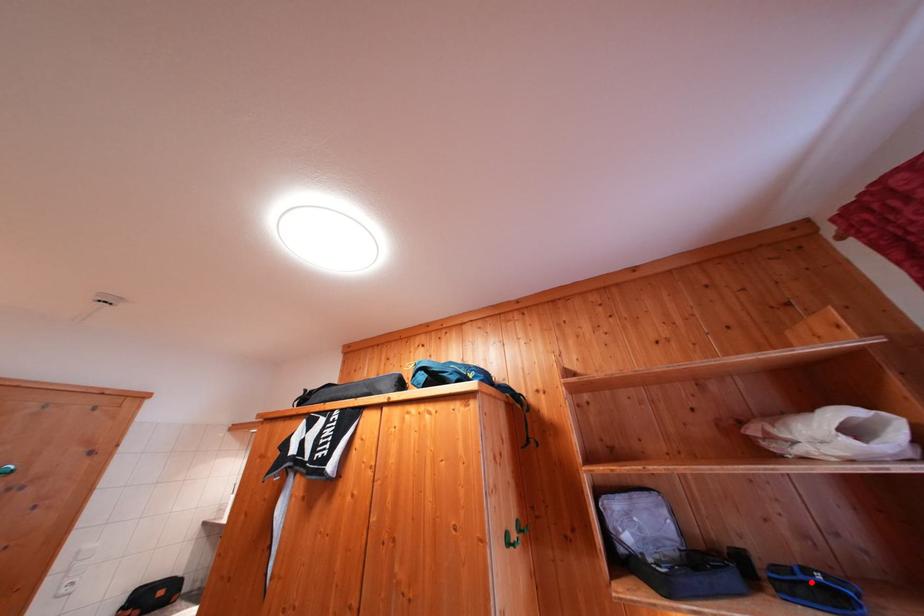
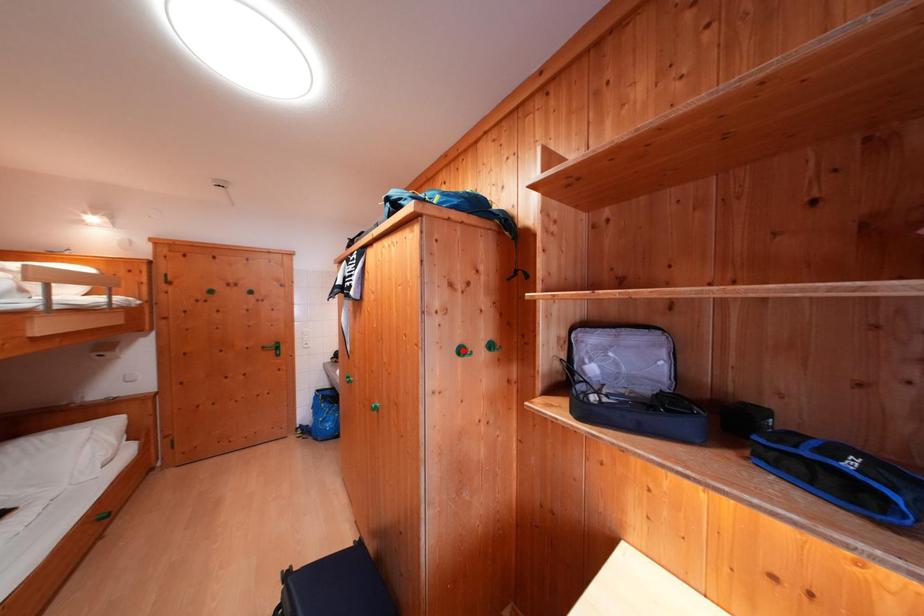
I am providing you with two images of the same scene from different viewpoints. A red point is marked on the first image and another point is marked on the second image. Is the red point in image1 aligned with the point shown in image2?

No